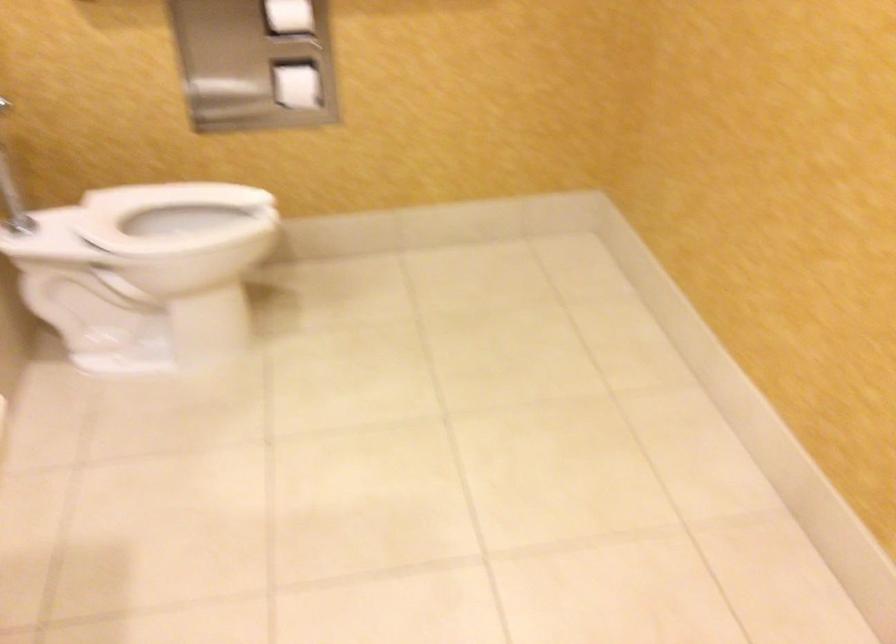
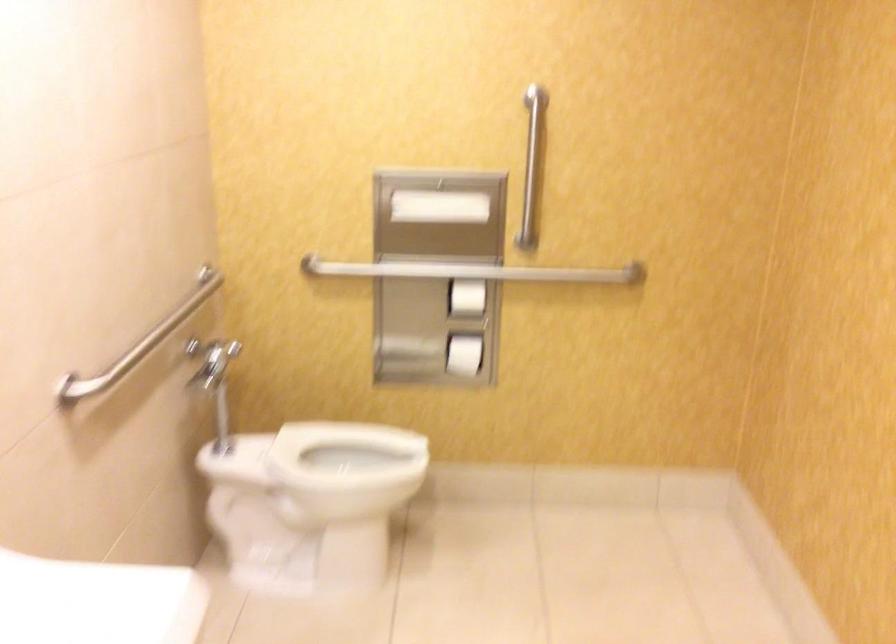
Question: What movement of the cameraman would produce the second image?

Choices:
 (A) Left
 (B) Right
 (C) Forward
 (D) Backward

Answer: (D)